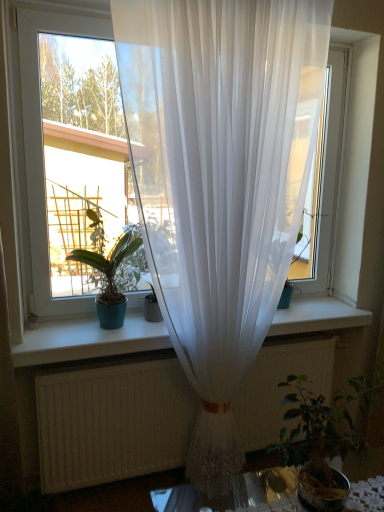
Question: Could you tell me if transparent white curtain at center is turned towards green leafy plant at lower right, placed as the second houseplant when sorted from back to front?

Choices:
 (A) yes
 (B) no

Answer: (A)

Question: Can you confirm if transparent white curtain at center is shorter than green leafy plant at lower right, marked as the 2th houseplant in a left-to-right arrangement?

Choices:
 (A) yes
 (B) no

Answer: (B)

Question: Considering the relative sizes of transparent white curtain at center and green leafy plant at lower right, the first houseplant ordered from the bottom, in the image provided, is transparent white curtain at center taller than green leafy plant at lower right, the first houseplant ordered from the bottom,?

Choices:
 (A) yes
 (B) no

Answer: (A)

Question: Considering the relative positions of transparent white curtain at center and green leafy plant at lower right, the first houseplant from the right, in the image provided, is transparent white curtain at center to the right of green leafy plant at lower right, the first houseplant from the right, from the viewer's perspective?

Choices:
 (A) no
 (B) yes

Answer: (A)

Question: Is the position of transparent white curtain at center less distant than that of green leafy plant at lower right, marked as the 2th houseplant in a left-to-right arrangement?

Choices:
 (A) yes
 (B) no

Answer: (B)

Question: Is point (127, 47) closer or farther from the camera than point (129, 114)?

Choices:
 (A) farther
 (B) closer

Answer: (B)

Question: From the image's perspective, is transparent white curtain at center positioned above or below translucent white curtain at center?

Choices:
 (A) above
 (B) below

Answer: (A)

Question: Based on their sizes in the image, would you say transparent white curtain at center is bigger or smaller than translucent white curtain at center?

Choices:
 (A) big
 (B) small

Answer: (B)

Question: Considering the positions of transparent white curtain at center and translucent white curtain at center in the image, is transparent white curtain at center wider or thinner than translucent white curtain at center?

Choices:
 (A) wide
 (B) thin

Answer: (B)

Question: Does point (137, 94) appear closer or farther from the camera than point (309, 424)?

Choices:
 (A) closer
 (B) farther

Answer: (A)

Question: From the image's perspective, is translucent white curtain at center above or below green leafy plant at lower right, marked as the 2th houseplant in a left-to-right arrangement?

Choices:
 (A) below
 (B) above

Answer: (B)

Question: Considering the positions of translucent white curtain at center and green leafy plant at lower right, the first houseplant from the right, in the image, is translucent white curtain at center taller or shorter than green leafy plant at lower right, the first houseplant from the right,?

Choices:
 (A) tall
 (B) short

Answer: (A)

Question: In terms of width, does translucent white curtain at center look wider or thinner when compared to green leafy plant at lower right, the first houseplant from the right?

Choices:
 (A) wide
 (B) thin

Answer: (B)

Question: From a real-world perspective, is green leafy plant at lower right, the 1th houseplant in the front-to-back sequence, positioned above or below transparent white curtain at center?

Choices:
 (A) above
 (B) below

Answer: (B)

Question: In terms of size, does green leafy plant at lower right, the first houseplant from the right, appear bigger or smaller than transparent white curtain at center?

Choices:
 (A) big
 (B) small

Answer: (B)